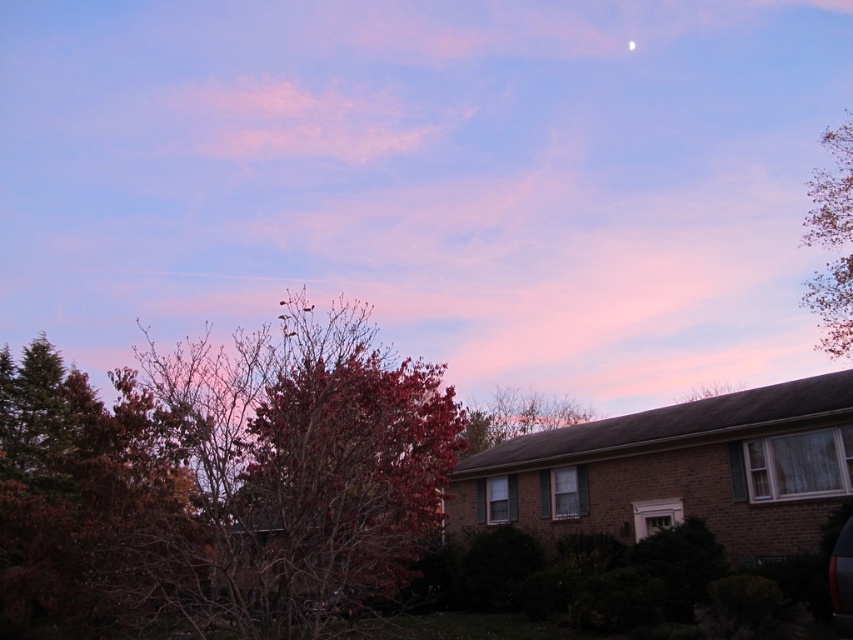
Question: Does reddish-brown bark tree at center-left appear over green leafy tree at upper right?

Choices:
 (A) yes
 (B) no

Answer: (B)

Question: Is pink cotton candy cloud at upper center smaller than green leafy tree at upper right?

Choices:
 (A) yes
 (B) no

Answer: (B)

Question: Can you confirm if pink cotton candy cloud at upper center is bigger than white glossy moon at upper center?

Choices:
 (A) yes
 (B) no

Answer: (A)

Question: Considering the real-world distances, which object is farthest from the green leafy tree at upper right?

Choices:
 (A) pink cotton candy cloud at upper center
 (B) reddish-brown bark tree at center-left
 (C) white glossy moon at upper center
 (D) leaves at upper center

Answer: (B)

Question: Considering the real-world distances, which object is farthest from the pink cotton candy cloud at upper center?

Choices:
 (A) reddish-brown bark tree at center-left
 (B) leaves at upper center
 (C) white glossy moon at upper center

Answer: (A)

Question: Estimate the real-world distances between objects in this image. Which object is farther from the pink cotton candy cloud at upper center?

Choices:
 (A) leaves at upper center
 (B) reddish-brown bark tree at center-left
 (C) white glossy moon at upper center
 (D) green leafy tree at upper right

Answer: (B)